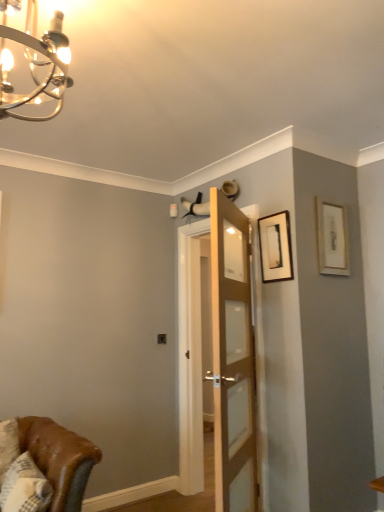
How much space does matte gold picture frame at upper right, which ranks as the 2th picture frame in left-to-right order, occupy horizontally?

It is 1.11 inches.

Where is `wooden door at center`? This screenshot has height=512, width=384. wooden door at center is located at coordinates (222, 354).

Where is `matte black picture frame at upper right, acting as the 2th picture frame starting from the right`? This screenshot has width=384, height=512. matte black picture frame at upper right, acting as the 2th picture frame starting from the right is located at coordinates (275, 247).

Identify the location of chrome/metallic chandelier at upper left. (32, 65).

The height and width of the screenshot is (512, 384). What do you see at coordinates (32, 65) in the screenshot?
I see `chrome/metallic chandelier at upper left` at bounding box center [32, 65].

The height and width of the screenshot is (512, 384). In order to click on white textured pillow at lower left in this screenshot , I will do `click(25, 487)`.

From the image's perspective, who appears lower, matte black picture frame at upper right, the 1th picture frame from the left, or white textured pillow at lower left?

white textured pillow at lower left, from the image's perspective.

From a real-world perspective, which is physically below, matte black picture frame at upper right, acting as the 2th picture frame starting from the right, or white textured pillow at lower left?

From a 3D spatial view, white textured pillow at lower left is below.

Considering the positions of objects matte black picture frame at upper right, acting as the 2th picture frame starting from the right, and white textured pillow at lower left in the image provided, who is in front, matte black picture frame at upper right, acting as the 2th picture frame starting from the right, or white textured pillow at lower left?

Positioned in front is white textured pillow at lower left.

Is matte black picture frame at upper right, acting as the 2th picture frame starting from the right, turned away from white textured pillow at lower left?

No, white textured pillow at lower left is not at the back of matte black picture frame at upper right, acting as the 2th picture frame starting from the right.

Which point is more forward, (348, 247) or (279, 221)?

Point (279, 221)

Is matte gold picture frame at upper right, which ranks as the 2th picture frame in left-to-right order, next to matte black picture frame at upper right, acting as the 2th picture frame starting from the right?

They are not placed beside each other.

Considering the relative sizes of matte gold picture frame at upper right, which ranks as the 2th picture frame in left-to-right order, and matte black picture frame at upper right, the 1th picture frame from the left, in the image provided, is matte gold picture frame at upper right, which ranks as the 2th picture frame in left-to-right order, thinner than matte black picture frame at upper right, the 1th picture frame from the left,?

Correct, the width of matte gold picture frame at upper right, which ranks as the 2th picture frame in left-to-right order, is less than that of matte black picture frame at upper right, the 1th picture frame from the left.

Looking at this image, from the image's perspective, which is above, matte gold picture frame at upper right, acting as the first picture frame starting from the right, or matte black picture frame at upper right, the 1th picture frame from the left?

matte gold picture frame at upper right, acting as the first picture frame starting from the right, from the image's perspective.

The height and width of the screenshot is (512, 384). What are the coordinates of `door behind the white textured pillow at lower left` in the screenshot? It's located at (222, 354).

Can you confirm if wooden door at center is bigger than white textured pillow at lower left?

Yes, wooden door at center is bigger than white textured pillow at lower left.

Measure the distance from wooden door at center to white textured pillow at lower left.

wooden door at center is 3.59 feet away from white textured pillow at lower left.

Considering the sizes of objects wooden door at center and white textured pillow at lower left in the image provided, who is thinner, wooden door at center or white textured pillow at lower left?

wooden door at center.

From the image's perspective, does matte gold picture frame at upper right, acting as the first picture frame starting from the right, appear lower than wooden door at center?

No.

Is matte gold picture frame at upper right, which ranks as the 2th picture frame in left-to-right order, aimed at wooden door at center?

No, matte gold picture frame at upper right, which ranks as the 2th picture frame in left-to-right order, does not turn towards wooden door at center.

Which is behind, point (337, 270) or point (3, 85)?

The point (337, 270) is farther.

Is matte gold picture frame at upper right, which ranks as the 2th picture frame in left-to-right order, to the left or to the right of chrome/metallic chandelier at upper left in the image?

From the image, it's evident that matte gold picture frame at upper right, which ranks as the 2th picture frame in left-to-right order, is to the right of chrome/metallic chandelier at upper left.

From the image's perspective, which one is positioned higher, matte gold picture frame at upper right, acting as the first picture frame starting from the right, or chrome/metallic chandelier at upper left?

From the image's view, chrome/metallic chandelier at upper left is above.

At what (x,y) coordinates should I click in order to perform the action: click on the 1st picture frame positioned below the chrome/metallic chandelier at upper left (from a real-world perspective). Please return your answer as a coordinate pair (x, y). Looking at the image, I should click on (332, 238).

Considering the relative sizes of chrome/metallic chandelier at upper left and white textured pillow at lower left in the image provided, is chrome/metallic chandelier at upper left thinner than white textured pillow at lower left?

No, chrome/metallic chandelier at upper left is not thinner than white textured pillow at lower left.

Is chrome/metallic chandelier at upper left at the right side of white textured pillow at lower left?

Yes.

Relative to white textured pillow at lower left, is chrome/metallic chandelier at upper left in front or behind?

chrome/metallic chandelier at upper left is positioned closer to the viewer than white textured pillow at lower left.

How distant is chrome/metallic chandelier at upper left from matte black picture frame at upper right, acting as the 2th picture frame starting from the right?

They are 5.38 feet apart.

Considering the relative sizes of chrome/metallic chandelier at upper left and matte black picture frame at upper right, acting as the 2th picture frame starting from the right, in the image provided, is chrome/metallic chandelier at upper left smaller than matte black picture frame at upper right, acting as the 2th picture frame starting from the right,?

Incorrect, chrome/metallic chandelier at upper left is not smaller in size than matte black picture frame at upper right, acting as the 2th picture frame starting from the right.

Based on the photo, can you confirm if chrome/metallic chandelier at upper left is taller than matte black picture frame at upper right, acting as the 2th picture frame starting from the right?

Indeed, chrome/metallic chandelier at upper left has a greater height compared to matte black picture frame at upper right, acting as the 2th picture frame starting from the right.

Which object is positioned more to the left, chrome/metallic chandelier at upper left or matte black picture frame at upper right, the 1th picture frame from the left?

Positioned to the left is chrome/metallic chandelier at upper left.

Locate an element on the screen. This screenshot has height=512, width=384. pillow that appears in front of the matte black picture frame at upper right, acting as the 2th picture frame starting from the right is located at coordinates (25, 487).

Where is `picture frame that appears above the matte black picture frame at upper right, the 1th picture frame from the left (from the image's perspective)`? The width and height of the screenshot is (384, 512). picture frame that appears above the matte black picture frame at upper right, the 1th picture frame from the left (from the image's perspective) is located at coordinates (332, 238).

In the scene shown: Looking at the image, which one is located closer to wooden door at center, chrome/metallic chandelier at upper left or matte black picture frame at upper right, the 1th picture frame from the left?

Among the two, matte black picture frame at upper right, the 1th picture frame from the left, is located nearer to wooden door at center.

Looking at the image, which one is located further to white textured pillow at lower left, wooden door at center or chrome/metallic chandelier at upper left?

chrome/metallic chandelier at upper left lies further to white textured pillow at lower left than the other object.

Estimate the real-world distances between objects in this image. Which object is further from white textured pillow at lower left, matte black picture frame at upper right, acting as the 2th picture frame starting from the right, or chrome/metallic chandelier at upper left?

matte black picture frame at upper right, acting as the 2th picture frame starting from the right, is further to white textured pillow at lower left.

Considering their positions, is matte black picture frame at upper right, the 1th picture frame from the left, positioned closer to chrome/metallic chandelier at upper left than white textured pillow at lower left?

matte black picture frame at upper right, the 1th picture frame from the left, lies closer to chrome/metallic chandelier at upper left than the other object.

When comparing their distances from chrome/metallic chandelier at upper left, does matte gold picture frame at upper right, acting as the first picture frame starting from the right, or matte black picture frame at upper right, the 1th picture frame from the left, seem closer?

Among the two, matte black picture frame at upper right, the 1th picture frame from the left, is located nearer to chrome/metallic chandelier at upper left.

Which object lies nearer to the anchor point white textured pillow at lower left, matte gold picture frame at upper right, acting as the first picture frame starting from the right, or chrome/metallic chandelier at upper left?

Among the two, chrome/metallic chandelier at upper left is located nearer to white textured pillow at lower left.

Which object lies further to the anchor point matte black picture frame at upper right, the 1th picture frame from the left, chrome/metallic chandelier at upper left or white textured pillow at lower left?

white textured pillow at lower left lies further to matte black picture frame at upper right, the 1th picture frame from the left, than the other object.

Looking at the image, which one is located closer to wooden door at center, white textured pillow at lower left or chrome/metallic chandelier at upper left?

Among the two, white textured pillow at lower left is located nearer to wooden door at center.

This screenshot has width=384, height=512. Find the location of `door between white textured pillow at lower left and matte gold picture frame at upper right, acting as the first picture frame starting from the right, in the horizontal direction`. door between white textured pillow at lower left and matte gold picture frame at upper right, acting as the first picture frame starting from the right, in the horizontal direction is located at coordinates (222, 354).

I want to click on picture frame between white textured pillow at lower left and matte gold picture frame at upper right, which ranks as the 2th picture frame in left-to-right order, from left to right, so click(x=275, y=247).

I want to click on light fixture between white textured pillow at lower left and matte gold picture frame at upper right, which ranks as the 2th picture frame in left-to-right order, in the horizontal direction, so click(32, 65).

Locate an element on the screen. This screenshot has width=384, height=512. picture frame between chrome/metallic chandelier at upper left and matte gold picture frame at upper right, acting as the first picture frame starting from the right, in the front-back direction is located at coordinates (275, 247).